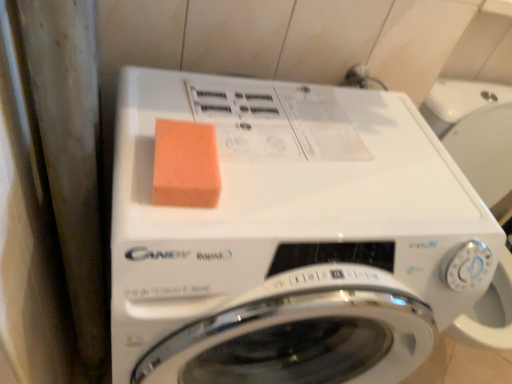
Question: Is orange sponge at upper center situated inside white glossy washing machine at center or outside?

Choices:
 (A) inside
 (B) outside

Answer: (A)

Question: In terms of height, does orange sponge at upper center look taller or shorter compared to white glossy washing machine at center?

Choices:
 (A) short
 (B) tall

Answer: (A)

Question: From a real-world perspective, is orange sponge at upper center physically located above or below white glossy washing machine at center?

Choices:
 (A) above
 (B) below

Answer: (A)

Question: Looking at their shapes, would you say white glossy washing machine at center is wider or thinner than orange sponge at upper center?

Choices:
 (A) wide
 (B) thin

Answer: (A)

Question: Relative to orange sponge at upper center, is white glossy washing machine at center in front or behind?

Choices:
 (A) behind
 (B) front

Answer: (B)

Question: Is point click(x=139, y=185) positioned closer to the camera than point click(x=160, y=200)?

Choices:
 (A) closer
 (B) farther

Answer: (B)

Question: Which is correct: white glossy washing machine at center is inside orange sponge at upper center, or outside of it?

Choices:
 (A) inside
 (B) outside

Answer: (B)